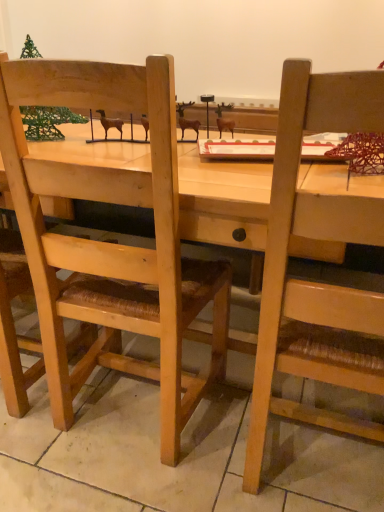
Where is `green wire christmas tree at upper left`? The image size is (384, 512). green wire christmas tree at upper left is located at coordinates (47, 121).

Looking at this image, what is the approximate height of wooden chair at left, the first chair when ordered from left to right?

The height of wooden chair at left, the first chair when ordered from left to right, is 1.05 meters.

Find the location of a particular element. This screenshot has height=512, width=384. wooden chair at right, arranged as the 1th chair when viewed from the right is located at coordinates (317, 283).

Who is smaller, wooden chair at left, which appears as the second chair when viewed from the right, or wooden chair at right, arranged as the 1th chair when viewed from the right?

wooden chair at left, which appears as the second chair when viewed from the right.

From the image's perspective, which is above, wooden chair at left, which appears as the second chair when viewed from the right, or wooden chair at right, arranged as the 1th chair when viewed from the right?

wooden chair at left, which appears as the second chair when viewed from the right, from the image's perspective.

Is wooden chair at left, which appears as the second chair when viewed from the right, at the left side of wooden chair at right, arranged as the 1th chair when viewed from the right?

Yes.

Are wooden chair at left, which appears as the second chair when viewed from the right, and wooden chair at right, which appears as the 2th chair when viewed from the left, located far from each other?

wooden chair at left, which appears as the second chair when viewed from the right, is near wooden chair at right, which appears as the 2th chair when viewed from the left, not far away.

Considering the sizes of objects wooden chair at right, arranged as the 1th chair when viewed from the right, and green wire christmas tree at upper left in the image provided, who is shorter, wooden chair at right, arranged as the 1th chair when viewed from the right, or green wire christmas tree at upper left?

With less height is green wire christmas tree at upper left.

From a real-world perspective, does wooden chair at right, which appears as the 2th chair when viewed from the left, stand above green wire christmas tree at upper left?

No, from a real-world perspective, wooden chair at right, which appears as the 2th chair when viewed from the left, is not on top of green wire christmas tree at upper left.

The image size is (384, 512). I want to click on christmas tree behind the wooden chair at right, which appears as the 2th chair when viewed from the left, so click(47, 121).

Does green wire christmas tree at upper left appear on the left side of wooden chair at left, which appears as the second chair when viewed from the right?

Incorrect, green wire christmas tree at upper left is not on the left side of wooden chair at left, which appears as the second chair when viewed from the right.

Would you consider green wire christmas tree at upper left to be distant from wooden chair at left, the first chair when ordered from left to right?

No, green wire christmas tree at upper left is in close proximity to wooden chair at left, the first chair when ordered from left to right.

Relative to wooden chair at left, the first chair when ordered from left to right, is green wire christmas tree at upper left in front or behind?

green wire christmas tree at upper left is positioned farther from the viewer than wooden chair at left, the first chair when ordered from left to right.

Could you tell me if green wire christmas tree at upper left is facing wooden chair at left, which appears as the second chair when viewed from the right?

Yes, green wire christmas tree at upper left is aimed at wooden chair at left, which appears as the second chair when viewed from the right.

Is wooden chair at right, arranged as the 1th chair when viewed from the right, further to camera compared to wooden chair at left, the first chair when ordered from left to right?

No, wooden chair at right, arranged as the 1th chair when viewed from the right, is closer to the camera.

Is wooden chair at right, arranged as the 1th chair when viewed from the right, at the left side of wooden chair at left, the first chair when ordered from left to right?

Incorrect, wooden chair at right, arranged as the 1th chair when viewed from the right, is not on the left side of wooden chair at left, the first chair when ordered from left to right.

Between wooden chair at right, arranged as the 1th chair when viewed from the right, and wooden chair at left, which appears as the second chair when viewed from the right, which one has larger width?

wooden chair at right, arranged as the 1th chair when viewed from the right, is wider.

Between wooden chair at right, which appears as the 2th chair when viewed from the left, and wooden chair at left, the first chair when ordered from left to right, which one has more height?

wooden chair at left, the first chair when ordered from left to right, is taller.

Is green wire christmas tree at upper left at the left side of wooden chair at right, which appears as the 2th chair when viewed from the left?

Yes, green wire christmas tree at upper left is to the left of wooden chair at right, which appears as the 2th chair when viewed from the left.

Is green wire christmas tree at upper left positioned behind wooden chair at right, which appears as the 2th chair when viewed from the left?

Yes, green wire christmas tree at upper left is further from the camera.

In the scene shown: Considering the relative sizes of green wire christmas tree at upper left and wooden chair at right, which appears as the 2th chair when viewed from the left, in the image provided, is green wire christmas tree at upper left taller than wooden chair at right, which appears as the 2th chair when viewed from the left,?

Incorrect, the height of green wire christmas tree at upper left is not larger of that of wooden chair at right, which appears as the 2th chair when viewed from the left.

Which is in front, point (21, 113) or point (352, 130)?

Positioned in front is point (352, 130).

Is wooden chair at left, which appears as the second chair when viewed from the right, facing away from green wire christmas tree at upper left?

No, green wire christmas tree at upper left is not at the back of wooden chair at left, which appears as the second chair when viewed from the right.

Considering the relative positions of wooden chair at left, the first chair when ordered from left to right, and green wire christmas tree at upper left in the image provided, is wooden chair at left, the first chair when ordered from left to right, to the left or to the right of green wire christmas tree at upper left?

Based on their positions, wooden chair at left, the first chair when ordered from left to right, is located to the left of green wire christmas tree at upper left.

Considering the points (0, 314) and (38, 113), which point is behind, point (0, 314) or point (38, 113)?

The point (38, 113) is farther from the camera.

Who is taller, wooden chair at left, which appears as the second chair when viewed from the right, or green wire christmas tree at upper left?

wooden chair at left, which appears as the second chair when viewed from the right, is taller.

Image resolution: width=384 pixels, height=512 pixels. Find the location of `chair to the right of wooden chair at left, the first chair when ordered from left to right`. chair to the right of wooden chair at left, the first chair when ordered from left to right is located at coordinates (317, 283).

At what (x,y) coordinates should I click in order to perform the action: click on the 2nd chair directly beneath the green wire christmas tree at upper left (from a real-world perspective). Please return your answer as a coordinate pair (x, y). The height and width of the screenshot is (512, 384). Looking at the image, I should click on (317, 283).

Based on their spatial positions, is green wire christmas tree at upper left or wooden chair at right, which appears as the 2th chair when viewed from the left, further from wooden chair at left, the first chair when ordered from left to right?

wooden chair at right, which appears as the 2th chair when viewed from the left, is positioned further to the anchor wooden chair at left, the first chair when ordered from left to right.

Considering their positions, is green wire christmas tree at upper left positioned closer to wooden chair at right, arranged as the 1th chair when viewed from the right, than wooden chair at left, which appears as the second chair when viewed from the right?

wooden chair at left, which appears as the second chair when viewed from the right, is closer to wooden chair at right, arranged as the 1th chair when viewed from the right.

Considering their positions, is wooden chair at left, which appears as the second chair when viewed from the right, positioned closer to green wire christmas tree at upper left than wooden chair at right, arranged as the 1th chair when viewed from the right?

wooden chair at left, which appears as the second chair when viewed from the right, is positioned closer to the anchor green wire christmas tree at upper left.

Based on their spatial positions, is wooden chair at right, arranged as the 1th chair when viewed from the right, or green wire christmas tree at upper left further from wooden chair at left, the first chair when ordered from left to right?

wooden chair at right, arranged as the 1th chair when viewed from the right, is further to wooden chair at left, the first chair when ordered from left to right.

From the image, which object appears to be nearer to wooden chair at right, which appears as the 2th chair when viewed from the left, wooden chair at left, the first chair when ordered from left to right, or green wire christmas tree at upper left?

Based on the image, wooden chair at left, the first chair when ordered from left to right, appears to be nearer to wooden chair at right, which appears as the 2th chair when viewed from the left.

Looking at the image, which one is located further to green wire christmas tree at upper left, wooden chair at right, which appears as the 2th chair when viewed from the left, or wooden chair at left, which appears as the second chair when viewed from the right?

wooden chair at right, which appears as the 2th chair when viewed from the left, is further to green wire christmas tree at upper left.

Identify the location of christmas tree located between wooden chair at left, which appears as the second chair when viewed from the right, and wooden chair at right, arranged as the 1th chair when viewed from the right, in the left-right direction. The width and height of the screenshot is (384, 512). (47, 121).